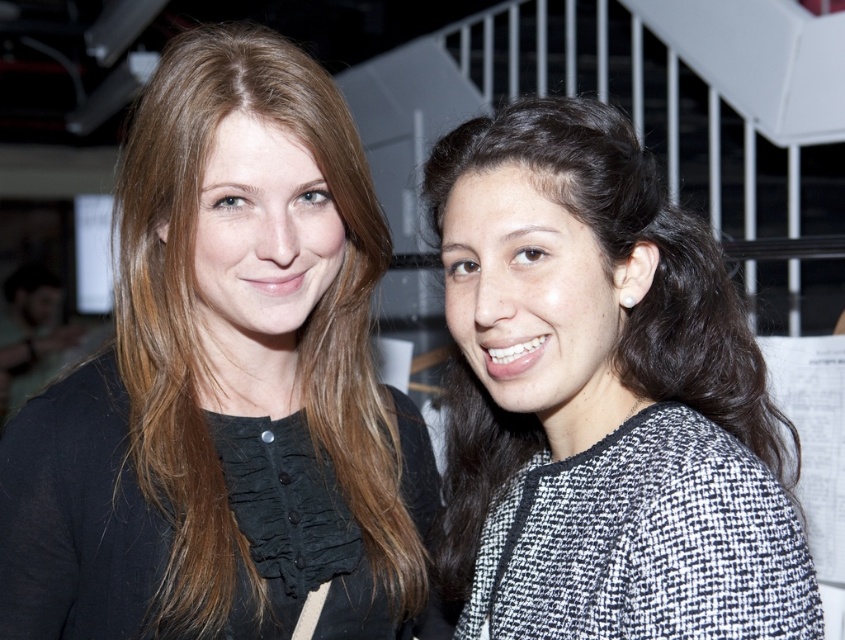
Can you confirm if matte black blouse at center is wider than black textured sweater at right?

Yes, matte black blouse at center is wider than black textured sweater at right.

Which is above, matte black blouse at center or black textured sweater at right?

Positioned higher is matte black blouse at center.

This screenshot has width=845, height=640. What do you see at coordinates (225, 387) in the screenshot?
I see `matte black blouse at center` at bounding box center [225, 387].

Locate an element on the screen. matte black blouse at center is located at coordinates (225, 387).